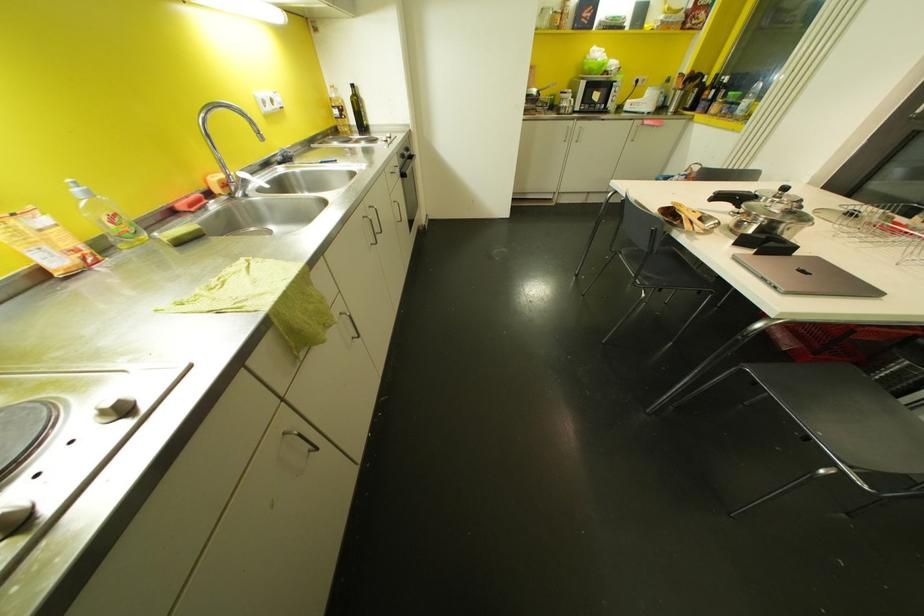
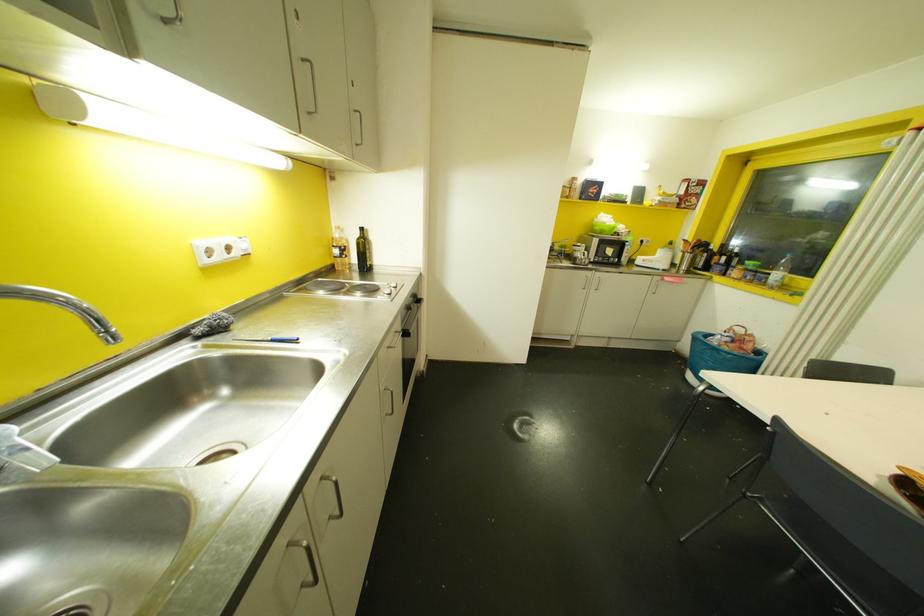
Find the pixel in the second image that matches point 335,111 in the first image.

(335, 251)